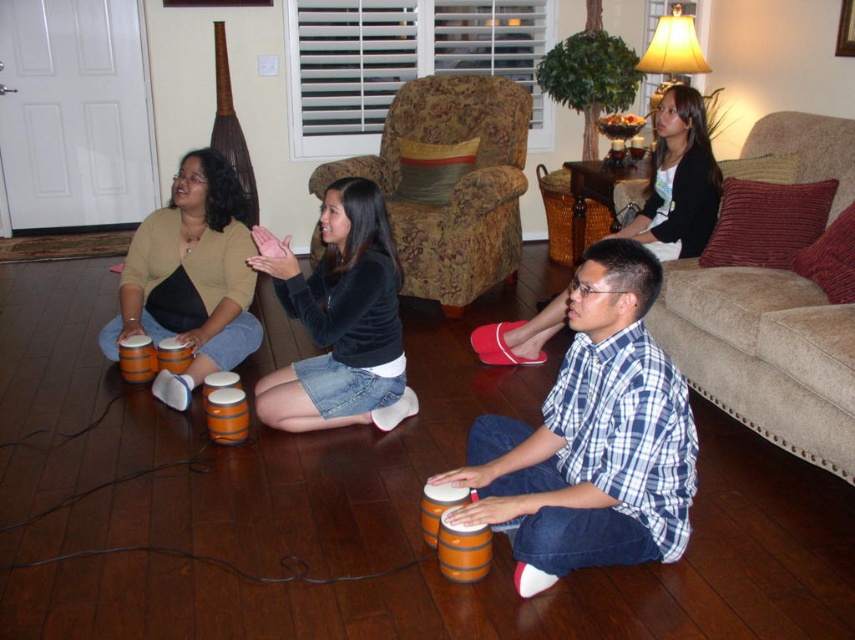
Question: Considering the real-world distances, which object is closest to the matte orange bongo drums at left?

Choices:
 (A) black matte skirt at center
 (B) wooden bongo drum at lower center
 (C) beige fabric armchair at upper right

Answer: (A)

Question: Among these objects, which one is farthest from the camera?

Choices:
 (A) beige fabric armchair at upper right
 (B) plaid cotton shirt at center
 (C) matte orange bongo drums at left
 (D) wooden bongo drum at lower center

Answer: (B)

Question: Can you confirm if wooden bongo drum at lower center is smaller than plaid cotton shirt at center?

Choices:
 (A) no
 (B) yes

Answer: (A)

Question: Is matte orange bongo drums at left below plaid cotton shirt at center?

Choices:
 (A) yes
 (B) no

Answer: (A)

Question: Is beige fabric armchair at upper right smaller than plaid cotton shirt at center?

Choices:
 (A) yes
 (B) no

Answer: (B)

Question: Which object is the closest to the matte orange bongo drums at left?

Choices:
 (A) floral fabric armchair at center
 (B) beige fabric armchair at upper right
 (C) plaid cotton shirt at center
 (D) wooden bongo drum at lower center

Answer: (A)